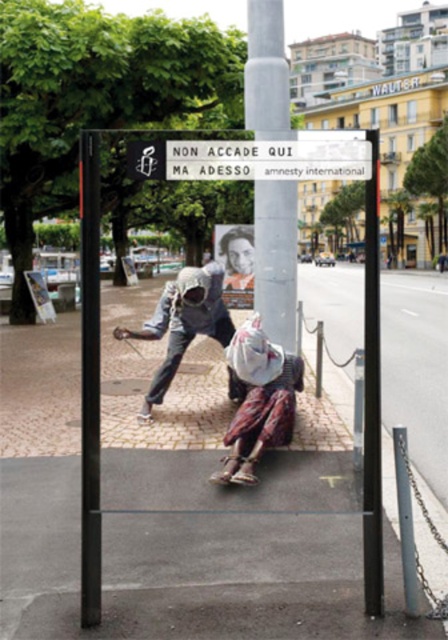
From the picture: Is white paper sign at upper center positioned in front of smooth skin portrait at center?

Yes.

The height and width of the screenshot is (640, 448). Find the location of `white paper sign at upper center`. white paper sign at upper center is located at coordinates (267, 160).

Where is `white paper sign at upper center`? Image resolution: width=448 pixels, height=640 pixels. white paper sign at upper center is located at coordinates (267, 160).

How far apart are white paper poster at center and silver metallic helmet at center?

white paper poster at center is 7.35 feet from silver metallic helmet at center.

Between white paper poster at center and silver metallic helmet at center, which one appears on the right side from the viewer's perspective?

silver metallic helmet at center is more to the right.

Does point (99, 541) come in front of point (193, 282)?

Yes, it is in front of point (193, 282).

I want to click on white paper poster at center, so click(x=90, y=376).

Can you confirm if white paper sign at upper center is thinner than black metal pole at center?

Indeed, white paper sign at upper center has a lesser width compared to black metal pole at center.

Which is below, white paper sign at upper center or black metal pole at center?

white paper sign at upper center is lower down.

You are a GUI agent. You are given a task and a screenshot of the screen. Output one action in this format:
    pyautogui.click(x=<x>, y=<y>)
    Task: Click on the white paper sign at upper center
    This screenshot has height=640, width=448.
    Given the screenshot: What is the action you would take?
    pyautogui.click(x=267, y=160)

Where is `white paper sign at upper center`? Image resolution: width=448 pixels, height=640 pixels. white paper sign at upper center is located at coordinates (267, 160).